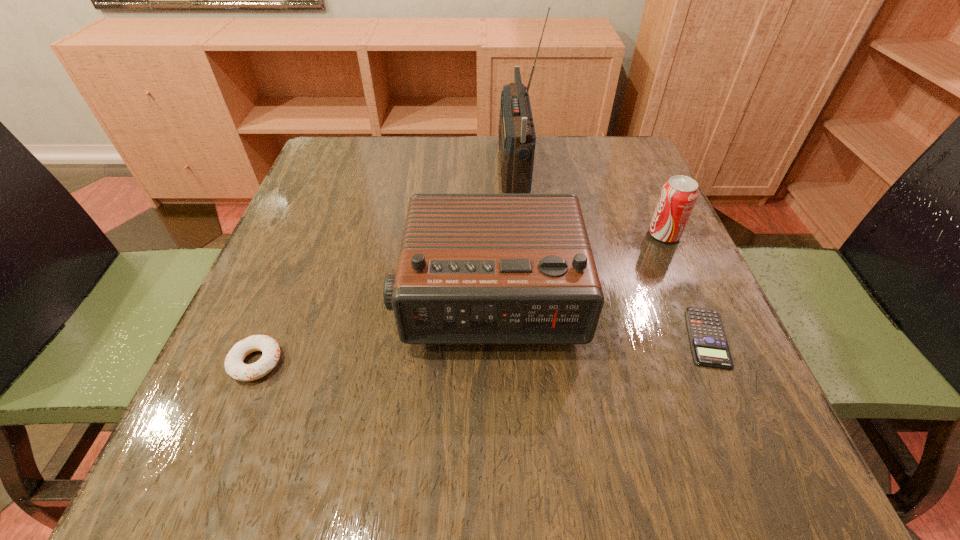
Locate an element on the screen. This screenshot has height=540, width=960. soda can present at the right edge is located at coordinates (678, 196).

This screenshot has width=960, height=540. What are the coordinates of `calculator positioned at the right edge` in the screenshot? It's located at (709, 344).

Locate an element on the screen. The width and height of the screenshot is (960, 540). free region at the far edge of the desktop is located at coordinates (433, 161).

In the image, there is a desktop. At what (x,y) coordinates should I click in order to perform the action: click on vacant area at the near edge. Please return your answer as a coordinate pair (x, y). The width and height of the screenshot is (960, 540). Looking at the image, I should click on (325, 482).

The width and height of the screenshot is (960, 540). In order to click on free space at the left edge in this screenshot , I will do `click(272, 268)`.

Locate an element on the screen. The height and width of the screenshot is (540, 960). free space at the right edge is located at coordinates (610, 265).

You are a GUI agent. You are given a task and a screenshot of the screen. Output one action in this format:
    pyautogui.click(x=<x>, y=<y>)
    Task: Click on the vacant region at the far left corner of the desktop
    
    Given the screenshot: What is the action you would take?
    pos(373,180)

In the image, there is a desktop. Identify the location of vacant space at the near left corner. (290, 435).

This screenshot has width=960, height=540. In the image, there is a desktop. Identify the location of free region at the far right corner. (607, 139).

Where is `vacant space at the near right corner of the desktop`? vacant space at the near right corner of the desktop is located at coordinates (701, 485).